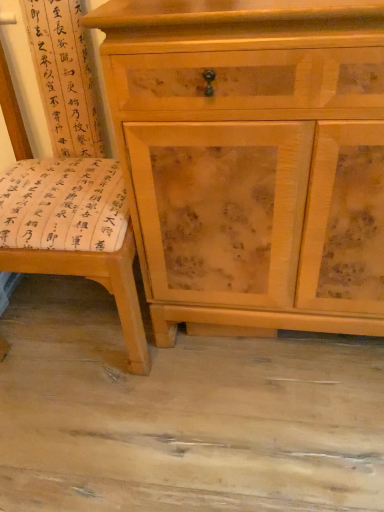
Question: Is wooden swivel chair at left aimed at light wood cabinet at center?

Choices:
 (A) yes
 (B) no

Answer: (B)

Question: Would you say wooden swivel chair at left contains light wood cabinet at center?

Choices:
 (A) no
 (B) yes

Answer: (A)

Question: Is wooden swivel chair at left facing away from light wood cabinet at center?

Choices:
 (A) yes
 (B) no

Answer: (B)

Question: Considering the relative sizes of wooden swivel chair at left and light wood cabinet at center in the image provided, is wooden swivel chair at left smaller than light wood cabinet at center?

Choices:
 (A) no
 (B) yes

Answer: (B)

Question: From a real-world perspective, is wooden swivel chair at left physically above light wood cabinet at center?

Choices:
 (A) yes
 (B) no

Answer: (A)

Question: Does wooden swivel chair at left lie behind light wood cabinet at center?

Choices:
 (A) yes
 (B) no

Answer: (B)

Question: From the image's perspective, is light wood cabinet at center on top of wooden swivel chair at left?

Choices:
 (A) yes
 (B) no

Answer: (A)

Question: Is wooden swivel chair at left completely or partially inside light wood cabinet at center?

Choices:
 (A) yes
 (B) no

Answer: (B)

Question: Is the position of light wood cabinet at center less distant than that of wooden swivel chair at left?

Choices:
 (A) no
 (B) yes

Answer: (A)

Question: Does light wood cabinet at center have a larger size compared to wooden swivel chair at left?

Choices:
 (A) yes
 (B) no

Answer: (A)

Question: Is light wood cabinet at center next to wooden swivel chair at left and touching it?

Choices:
 (A) yes
 (B) no

Answer: (B)

Question: From a real-world perspective, does light wood cabinet at center sit lower than wooden swivel chair at left?

Choices:
 (A) no
 (B) yes

Answer: (B)

Question: Looking at the image, does light wood cabinet at center seem bigger or smaller compared to wooden swivel chair at left?

Choices:
 (A) big
 (B) small

Answer: (A)